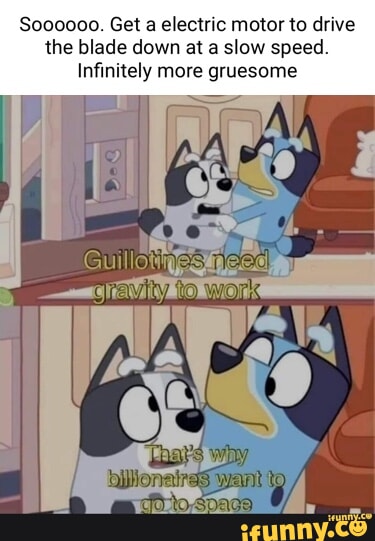
Locate an element on the screen. The image size is (375, 541). floor is located at coordinates (41, 285), (16, 510).